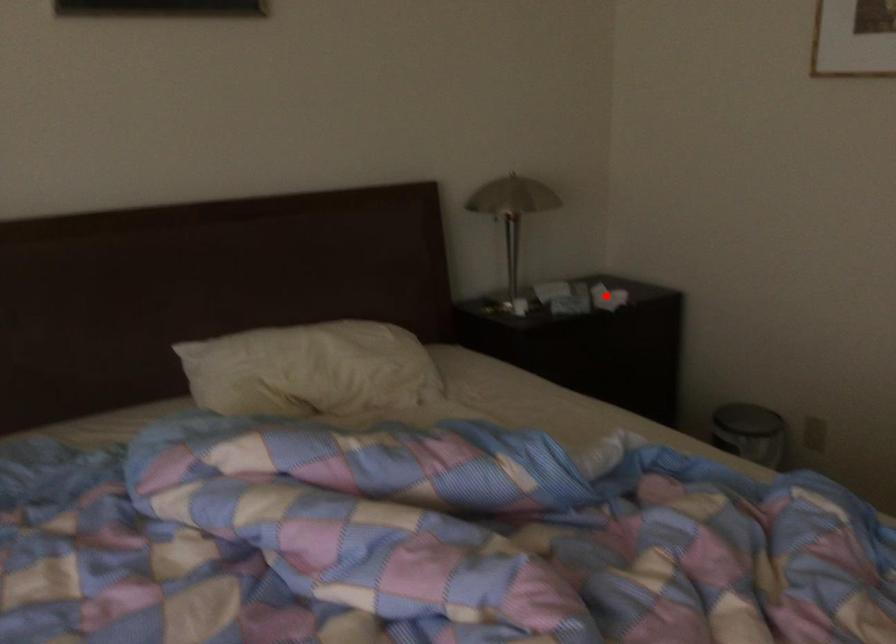
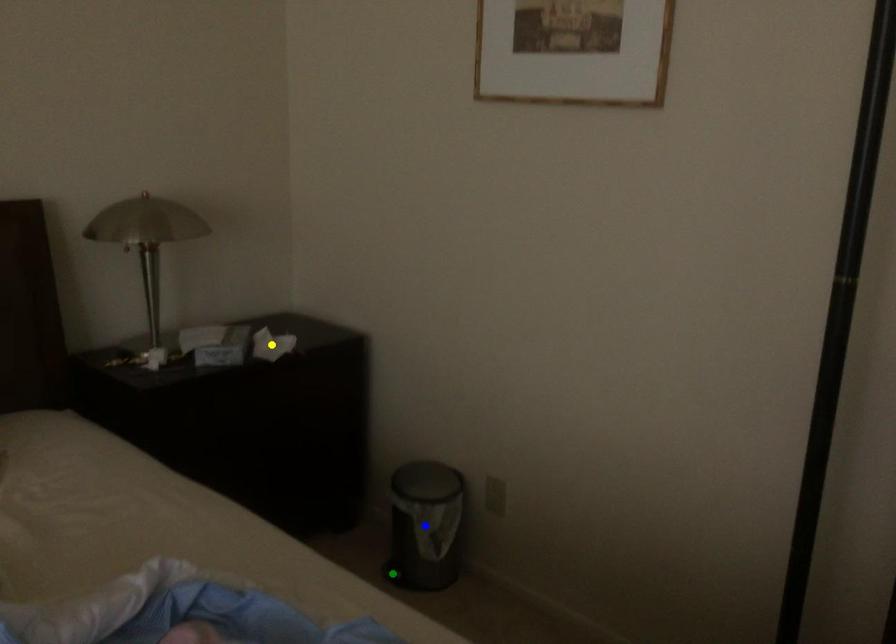
Question: I am providing you with two images of the same scene from different viewpoints. A red point is marked on the first image. You are given multiple points on the second image. Which mark in image 2 goes with the point in image 1?

Choices:
 (A) green point
 (B) blue point
 (C) yellow point

Answer: (C)